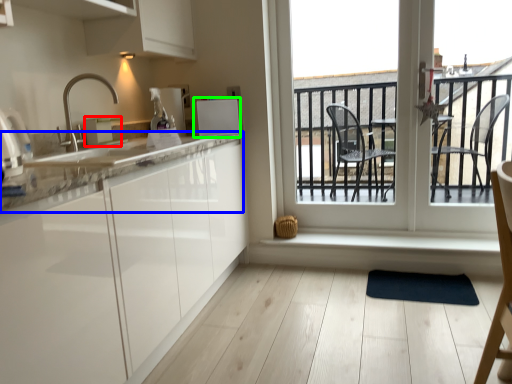
Question: Considering the real-world distances, which object is closest to appliance (highlighted by a red box)? countertop (highlighted by a blue box) or appliance (highlighted by a green box).

Choices:
 (A) countertop
 (B) appliance

Answer: (B)